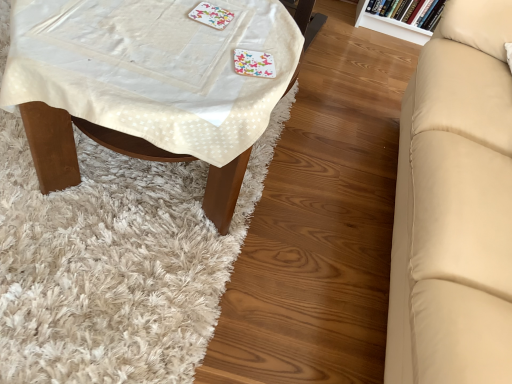
Locate an element on the screen. This screenshot has width=512, height=384. empty space that is ontop of white fabric-covered table at left (from a real-world perspective) is located at coordinates (135, 49).